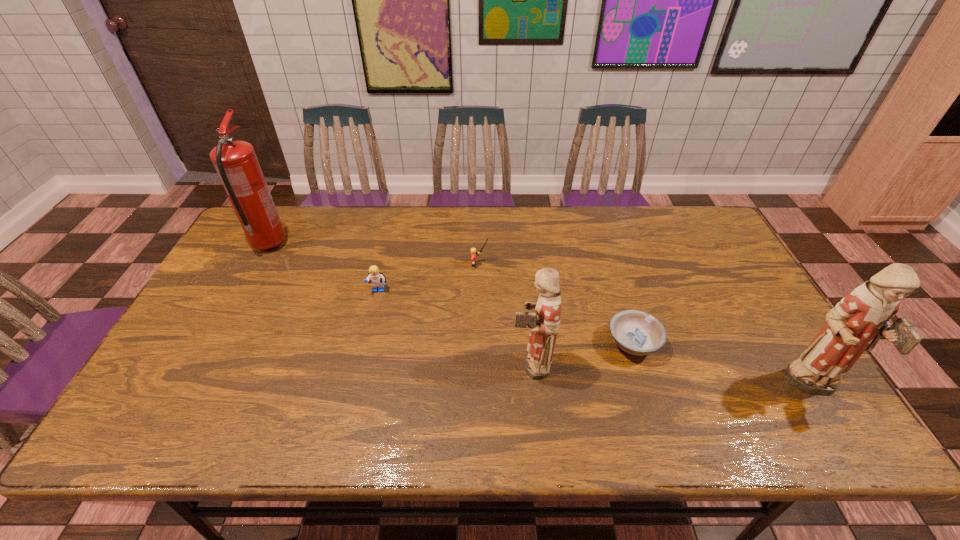
At what (x,y) coordinates should I click in order to perform the action: click on free space that satisfies the following two spatial constraints: 1. on the front-facing side of the second object from right to left; 2. on the left side of the left Lego. Please return your answer as a coordinate pair (x, y). The height and width of the screenshot is (540, 960). Looking at the image, I should click on (366, 343).

Locate an element on the screen. The image size is (960, 540). free spot that satisfies the following two spatial constraints: 1. on the front-facing side of the right Lego; 2. on the front-facing side of the fifth object from right to left is located at coordinates (479, 291).

Where is `vacant space that satisfies the following two spatial constraints: 1. on the front-facing side of the fifth object from left to right; 2. on the right side of the right Lego`? vacant space that satisfies the following two spatial constraints: 1. on the front-facing side of the fifth object from left to right; 2. on the right side of the right Lego is located at coordinates (479, 343).

Locate an element on the screen. The image size is (960, 540). vacant space that satisfies the following two spatial constraints: 1. on the front-facing side of the third object from left to right; 2. on the front-facing side of the nearer Lego is located at coordinates (479, 291).

The height and width of the screenshot is (540, 960). What are the coordinates of `free spot that satisfies the following two spatial constraints: 1. on the front-facing side of the fourth object from right to left; 2. on the right side of the second object from right to left` in the screenshot? It's located at pos(479,343).